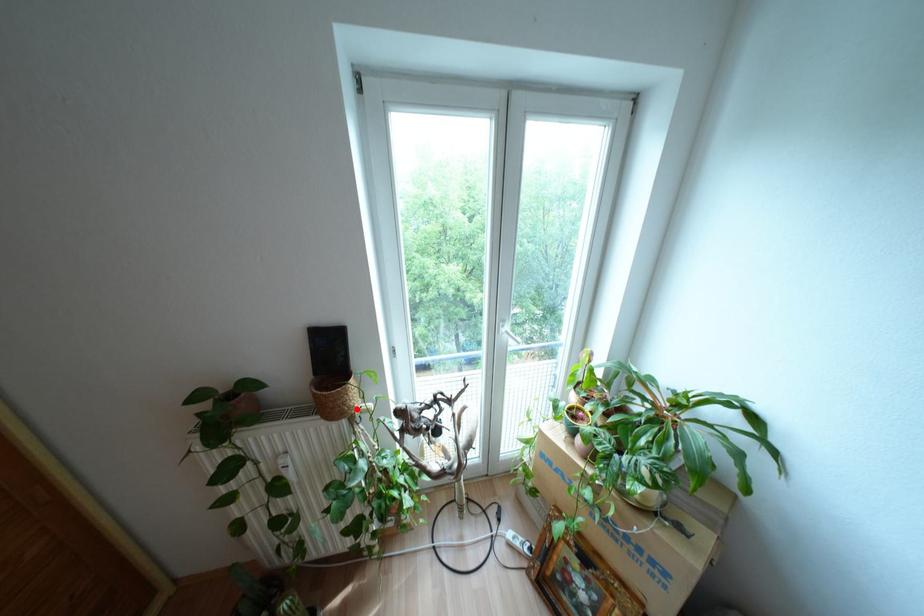
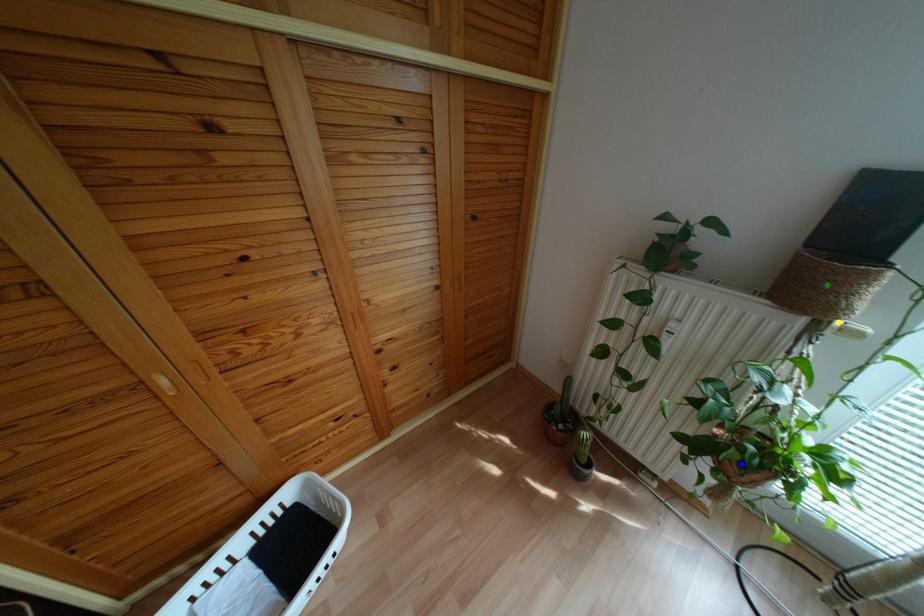
Question: I am providing you with two images of the same scene from different viewpoints. A red point is marked on the first image. You are given multiple points on the second image. Can you choose the point in image 2 that corresponds to the point in image 1?

Choices:
 (A) yellow point
 (B) blue point
 (C) green point

Answer: (A)